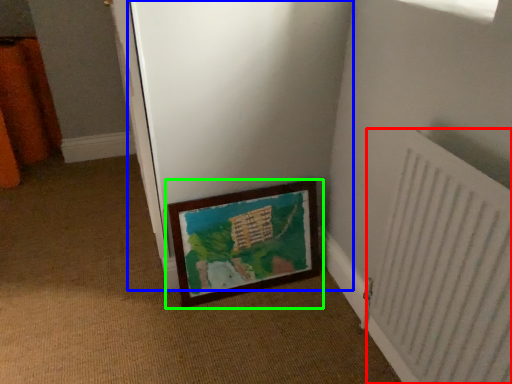
Question: Based on their relative distances, which object is nearer to radiator (highlighted by a red box)? Choose from screen door (highlighted by a blue box) and picture frame (highlighted by a green box).

Choices:
 (A) screen door
 (B) picture frame

Answer: (B)